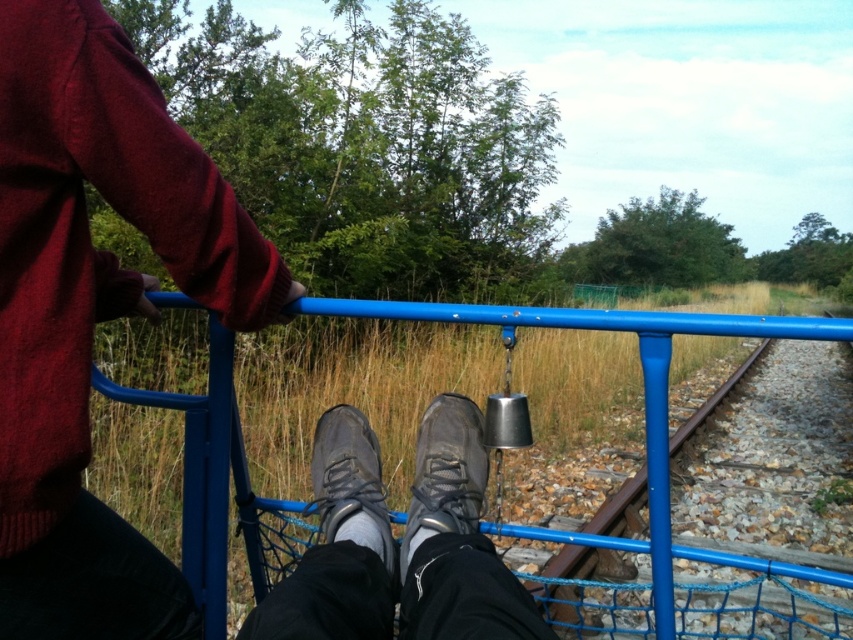
You are a passenger on the train and want to place a 12 inch long object between your feet and the blue metal railing. Given the dark grey leather shoe at center is 33.88 inches from viewer, can you fit the object without moving your feet?

The dark grey leather shoe at center is 33.88 inches from viewer. Since the object is 12 inches long, there is sufficient space between the shoe and the railing to place it without moving your feet.

You are sitting on a train and looking down. You see the maroon sweater at upper left and the dark gray fabric shoe at center. Which object is nearer to you?

The maroon sweater at upper left is closer to you than the dark gray fabric shoe at center.